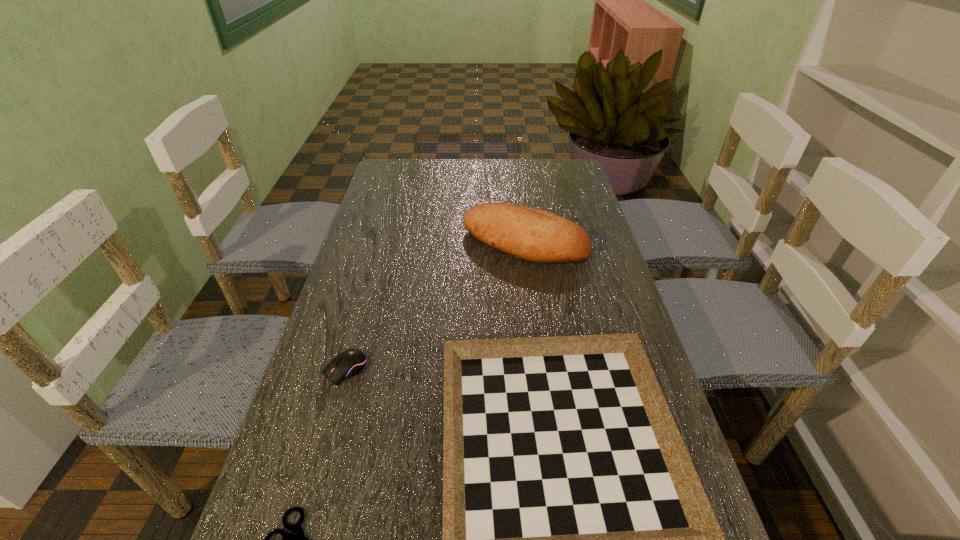
Image resolution: width=960 pixels, height=540 pixels. What are the coordinates of `vacant point located between the tallest object and the computer mouse` in the screenshot? It's located at (435, 306).

This screenshot has height=540, width=960. In order to click on free spot between the tallest object and the second shortest object in this screenshot , I will do `click(435, 306)`.

Find the location of a particular element. This screenshot has height=540, width=960. vacant space that is in between the computer mouse and the farthest object is located at coordinates (435, 306).

I want to click on object that ranks as the third closest to the tallest object, so click(296, 539).

What are the coordinates of `object that is the second closest one to the computer mouse` in the screenshot? It's located at pos(296,539).

What are the coordinates of `vacant space that satisfies the following two spatial constraints: 1. on the back side of the second shortest object; 2. on the left side of the tallest object` in the screenshot? It's located at (381, 242).